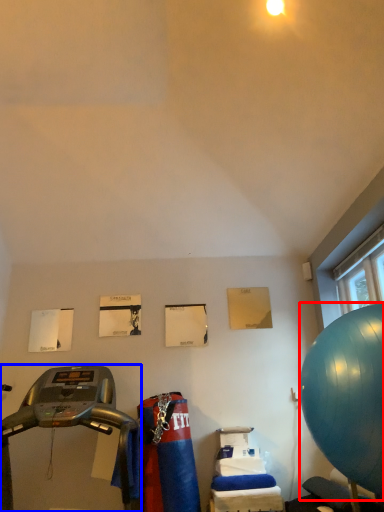
Question: Which point is further to the camera, ball (highlighted by a red box) or treadmill (highlighted by a blue box)?

Choices:
 (A) ball
 (B) treadmill

Answer: (A)